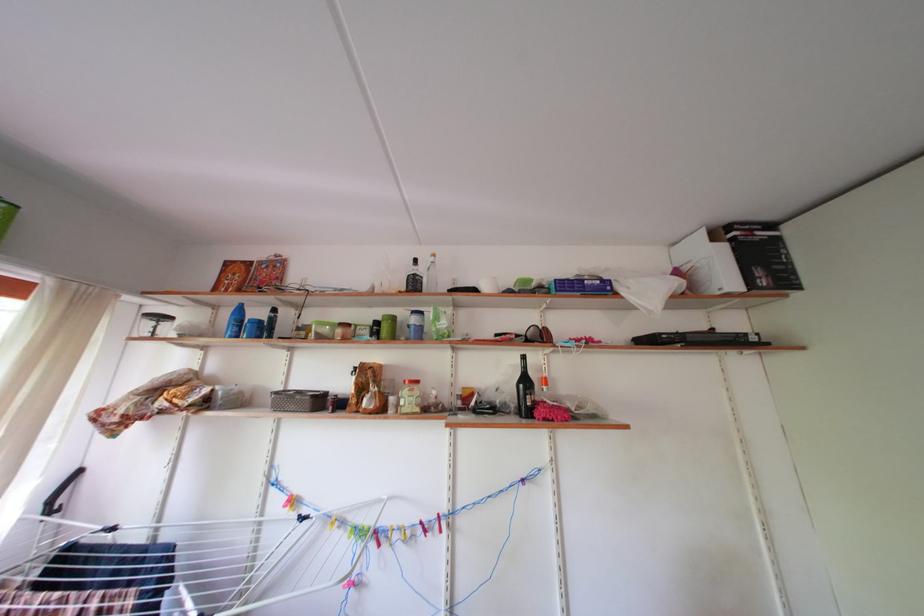
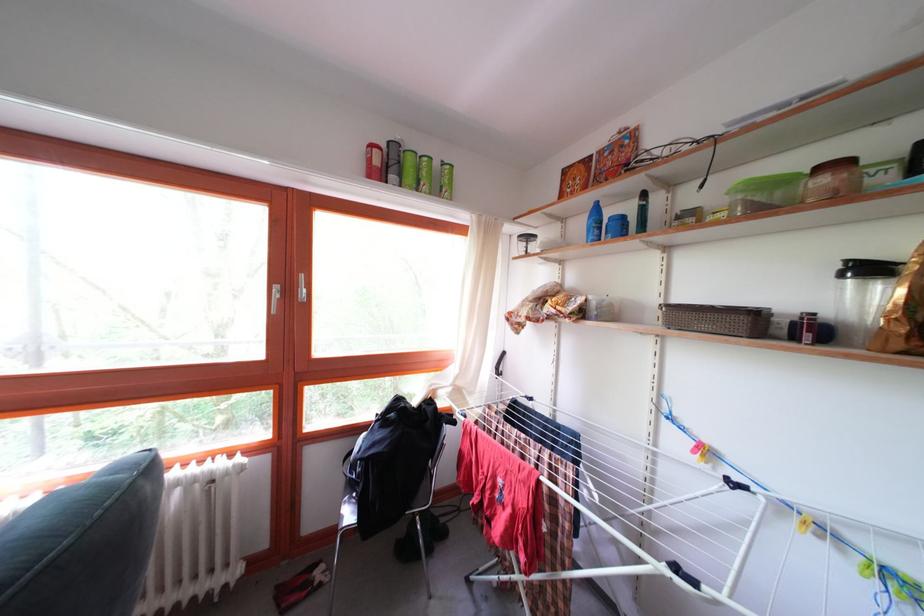
Question: The first image is from the beginning of the video and the second image is from the end. How did the camera likely rotate when shooting the video?

Choices:
 (A) Left
 (B) Right
 (C) Up
 (D) Down

Answer: (A)